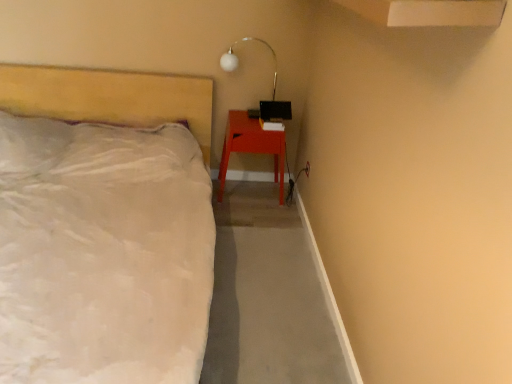
Question: Which is correct: white glass lamp at upper center is inside matte wood nightstand at lower right, or outside of it?

Choices:
 (A) outside
 (B) inside

Answer: (A)

Question: From the image's perspective, is white glass lamp at upper center above or below matte wood nightstand at lower right?

Choices:
 (A) below
 (B) above

Answer: (B)

Question: Which is farther from the matte wood nightstand at lower right?

Choices:
 (A) matte white bed at left
 (B) white glass lamp at upper center

Answer: (A)

Question: Estimate the real-world distances between objects in this image. Which object is closer to the matte white bed at left?

Choices:
 (A) matte wood nightstand at lower right
 (B) white glass lamp at upper center

Answer: (A)